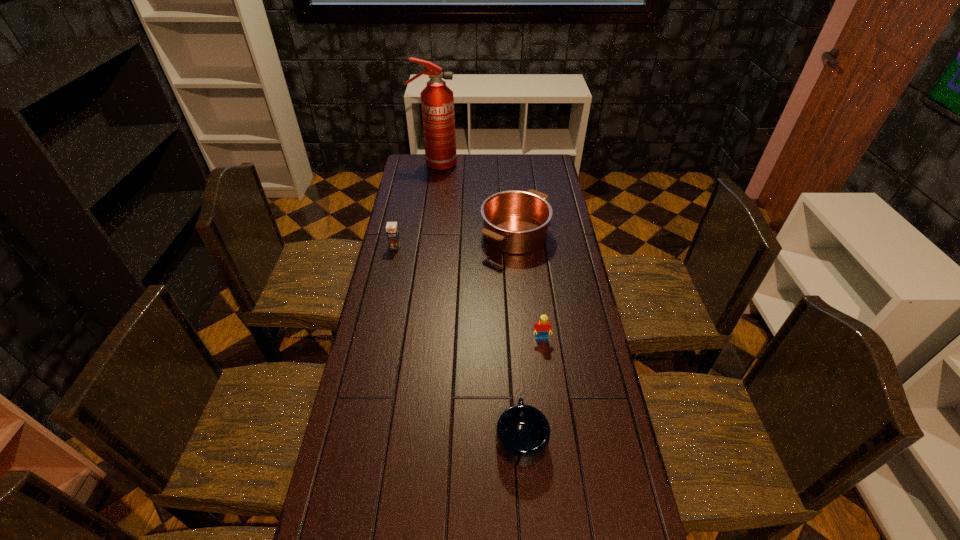
Locate an element on the screen. The height and width of the screenshot is (540, 960). free space located on the face of the second nearest object is located at coordinates (544, 361).

Find the location of `vacant point located 0.160m with the handle on the side of the shortest object`. vacant point located 0.160m with the handle on the side of the shortest object is located at coordinates (516, 363).

Image resolution: width=960 pixels, height=540 pixels. I want to click on free space located 0.090m with the handle on the side of the shortest object, so click(x=517, y=382).

At what (x,y) coordinates should I click in order to perform the action: click on vacant space located with the handle on the side of the shortest object. Please return your answer as a coordinate pair (x, y). Image resolution: width=960 pixels, height=540 pixels. Looking at the image, I should click on (518, 391).

Locate an element on the screen. The height and width of the screenshot is (540, 960). object that is at the far edge is located at coordinates (437, 100).

The width and height of the screenshot is (960, 540). In order to click on fire extinguisher at the left edge in this screenshot , I will do `click(437, 100)`.

Find the location of a particular element. This screenshot has height=540, width=960. chocolate milk present at the left edge is located at coordinates (392, 231).

Where is `saucepan that is positioned at the right edge`? This screenshot has height=540, width=960. saucepan that is positioned at the right edge is located at coordinates (516, 222).

Locate an element on the screen. This screenshot has width=960, height=540. Lego that is at the right edge is located at coordinates (542, 327).

I want to click on object situated at the far left corner, so click(x=437, y=100).